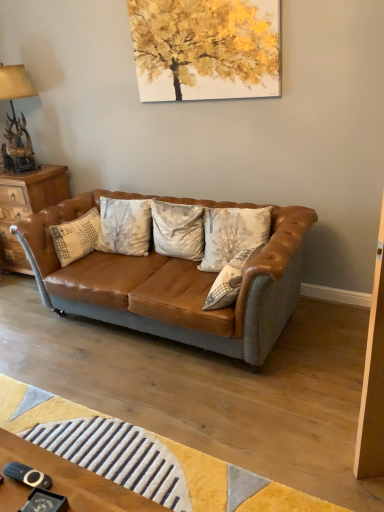
Where is `space that is in front of leather couch at center`? This screenshot has height=512, width=384. space that is in front of leather couch at center is located at coordinates (194, 403).